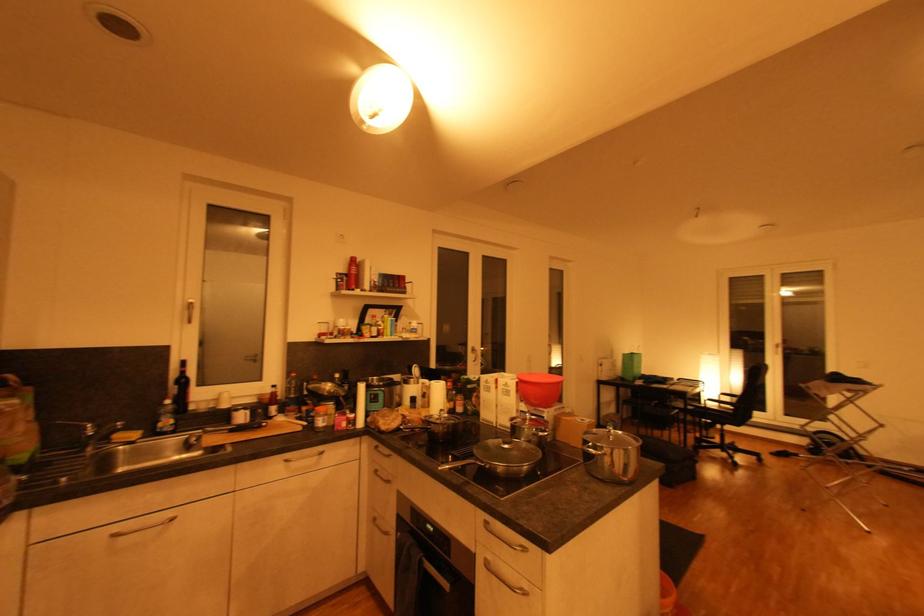
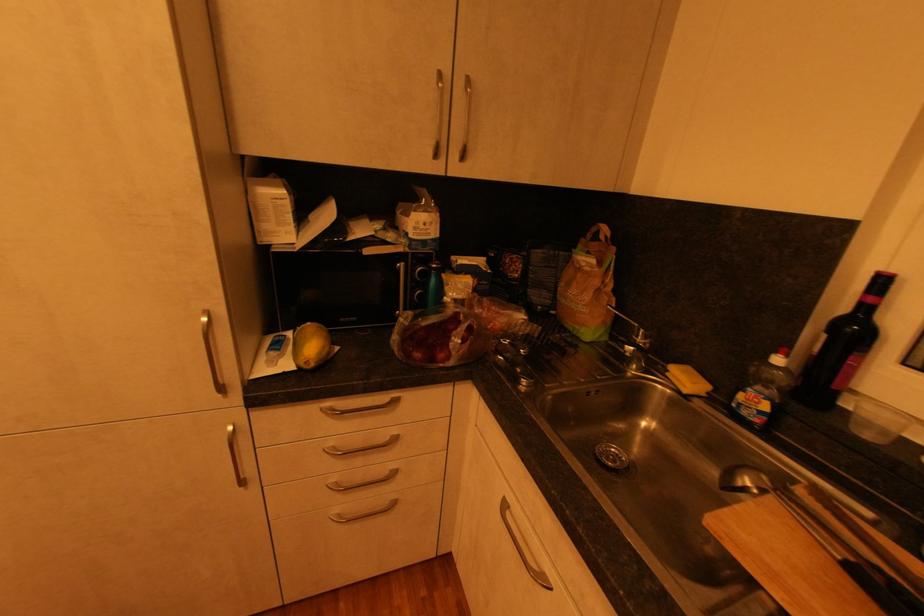
Locate, in the second image, the point that corresponds to the point at 176,429 in the first image.

(760, 419)